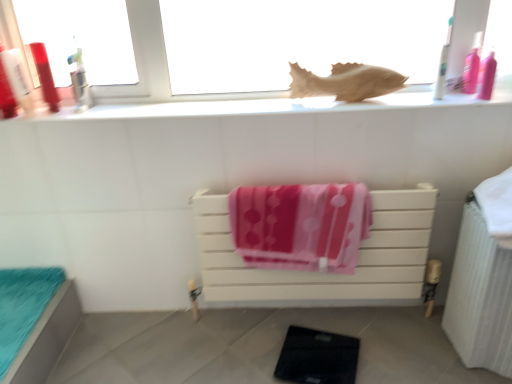
Locate an element on the screen. Image resolution: width=512 pixels, height=384 pixels. free space between teal fabric cushion at lower left, placed as the 1th furniture when sorted from left to right, and white wooden towel rack at center, the second furniture from the left is located at coordinates (175, 339).